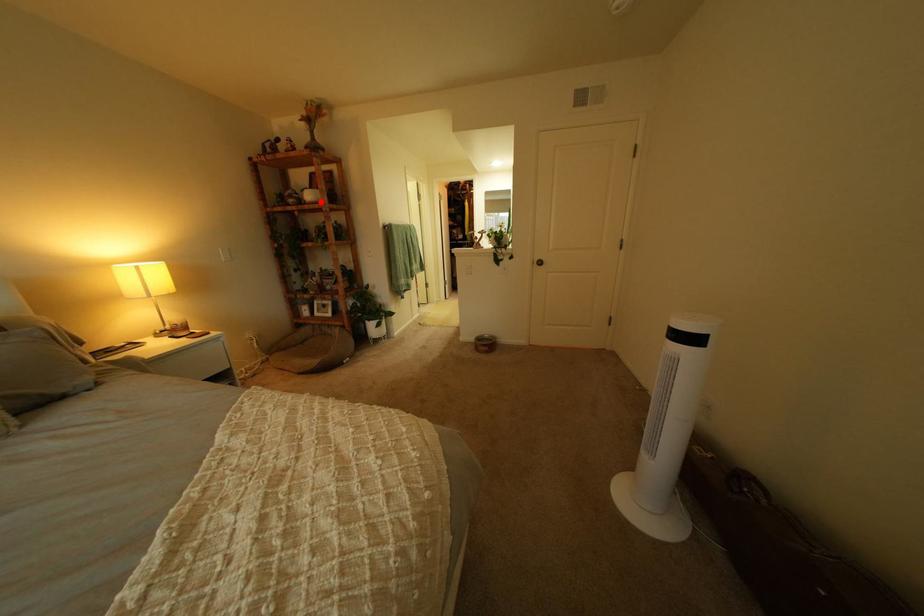
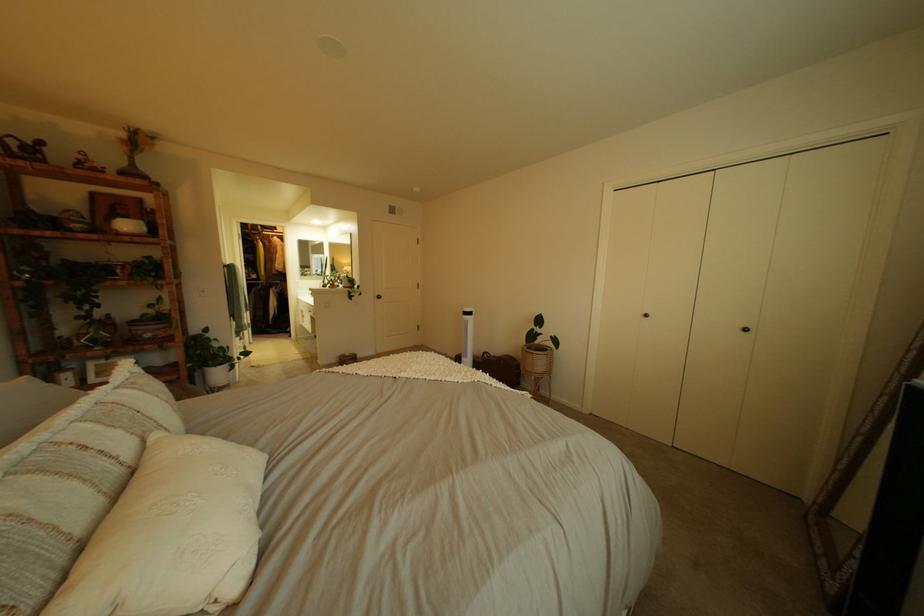
Question: I am providing you with two images of the same scene from different viewpoints. A red point is marked on the first image. At the location where the point appears in image 1, is it still visible in image 2?

Choices:
 (A) Yes
 (B) No

Answer: (A)